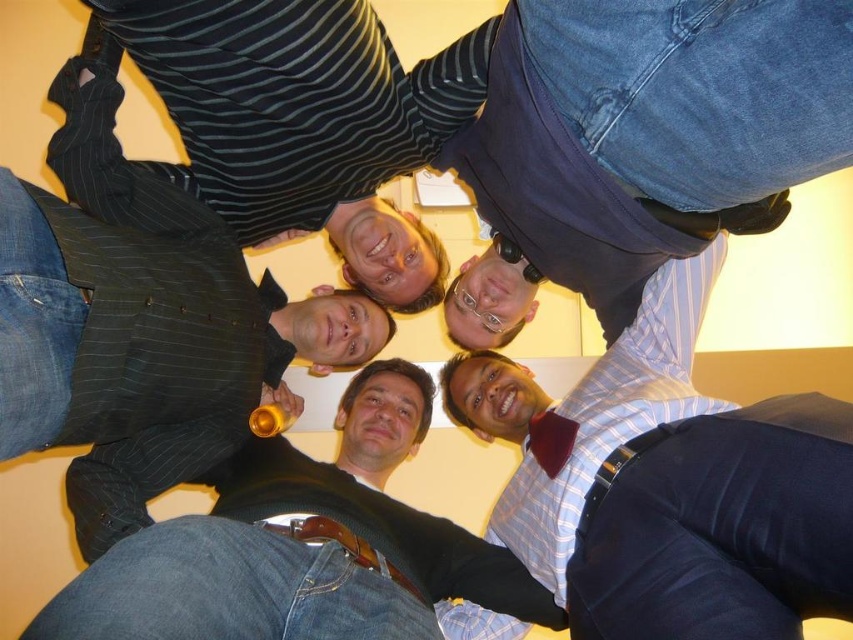
Question: Does striped fabric shirt at upper center appear under blue striped shirt at center?

Choices:
 (A) no
 (B) yes

Answer: (A)

Question: Is striped fabric shirt at upper center thinner than blue striped shirt at center?

Choices:
 (A) no
 (B) yes

Answer: (A)

Question: Is blue jeans at upper center below striped fabric shirt at upper center?

Choices:
 (A) yes
 (B) no

Answer: (A)

Question: Among these points, which one is nearest to the camera?

Choices:
 (A) (624, 340)
 (B) (590, 189)
 (C) (109, 582)

Answer: (C)

Question: Which of the following is the closest to the observer?

Choices:
 (A) (227, 77)
 (B) (688, 403)
 (C) (346, 611)

Answer: (A)

Question: Among these objects, which one is nearest to the camera?

Choices:
 (A) blue jeans at upper center
 (B) striped fabric shirt at upper center

Answer: (A)